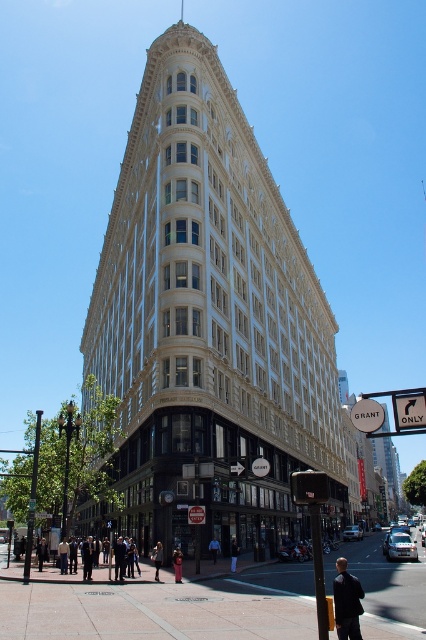
Is white stone building at center to the left of concrete sidewalk at lower center from the viewer's perspective?

Indeed, white stone building at center is positioned on the left side of concrete sidewalk at lower center.

Measure the distance between point (x=238, y=157) and camera.

A distance of 88.22 meters exists between point (x=238, y=157) and camera.

The image size is (426, 640). I want to click on white stone building at center, so click(x=210, y=324).